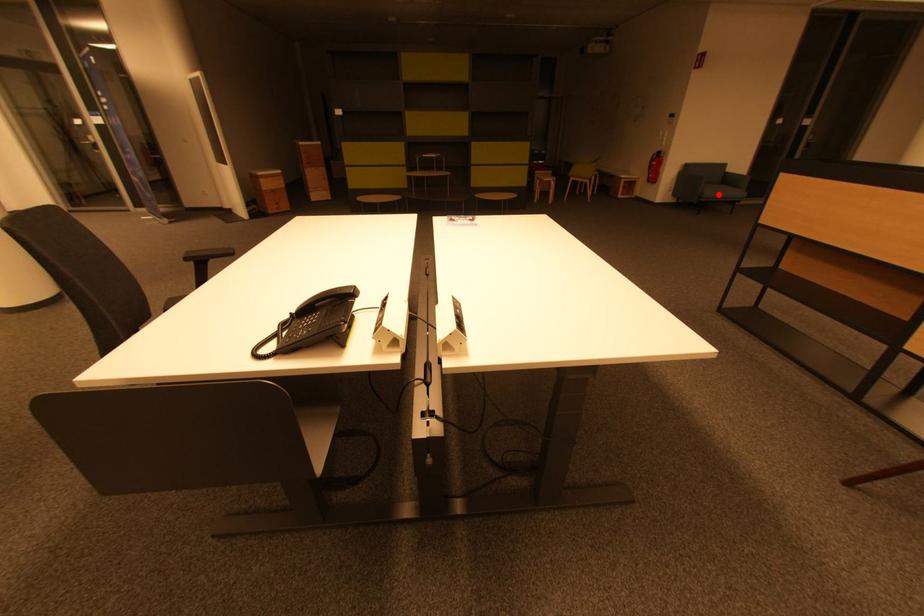
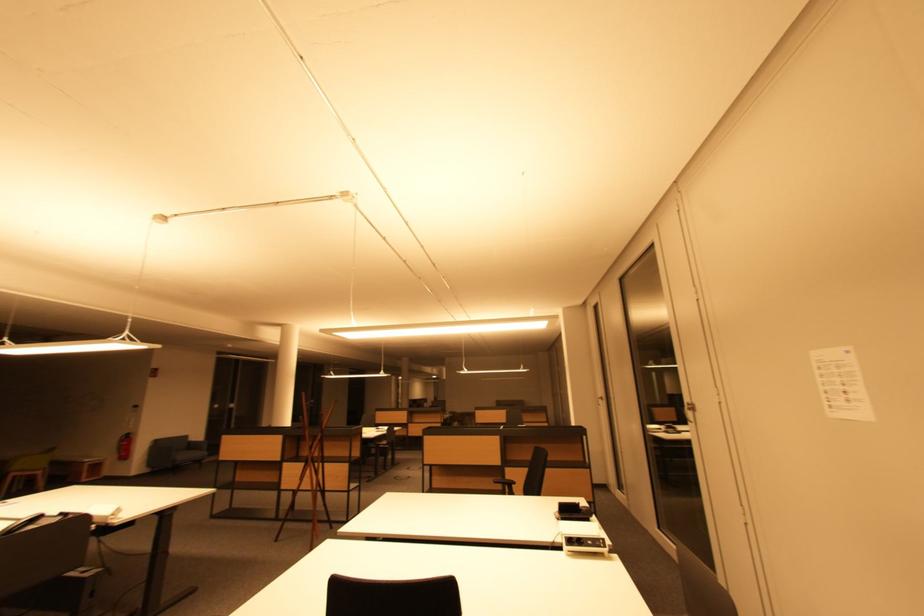
Locate, in the second image, the point that corresponds to the highlighted location in the first image.

(188, 458)